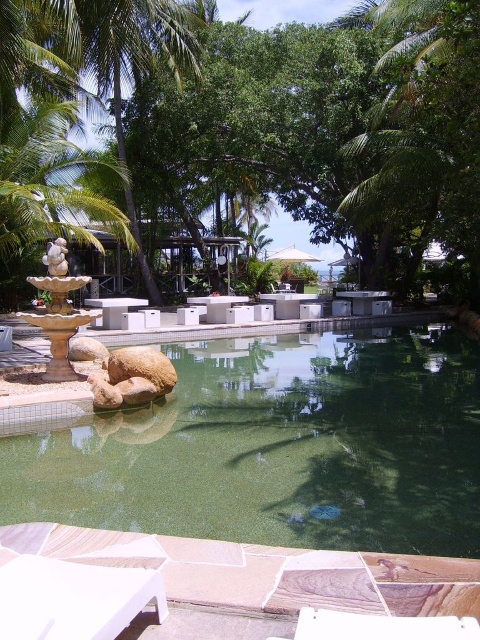
Can you confirm if green tile swimming pool at center is positioned above stone fountain at center?

Incorrect, green tile swimming pool at center is not positioned above stone fountain at center.

Which is behind, point (377, 472) or point (56, 301)?

The point (56, 301) is behind.

Locate an element on the screen. The height and width of the screenshot is (640, 480). green tile swimming pool at center is located at coordinates (276, 445).

Can you confirm if green leafy tree at center is positioned above stone fountain at center?

Yes, green leafy tree at center is above stone fountain at center.

Between point (316, 76) and point (66, 364), which one is positioned in front?

Point (66, 364) is more forward.

Find the location of `green leafy tree at center`. green leafy tree at center is located at coordinates (325, 134).

Is point (57, 488) behind point (166, 61)?

No.

The height and width of the screenshot is (640, 480). What do you see at coordinates (276, 445) in the screenshot?
I see `green tile swimming pool at center` at bounding box center [276, 445].

Find the location of a particular element. The image size is (480, 640). green tile swimming pool at center is located at coordinates (276, 445).